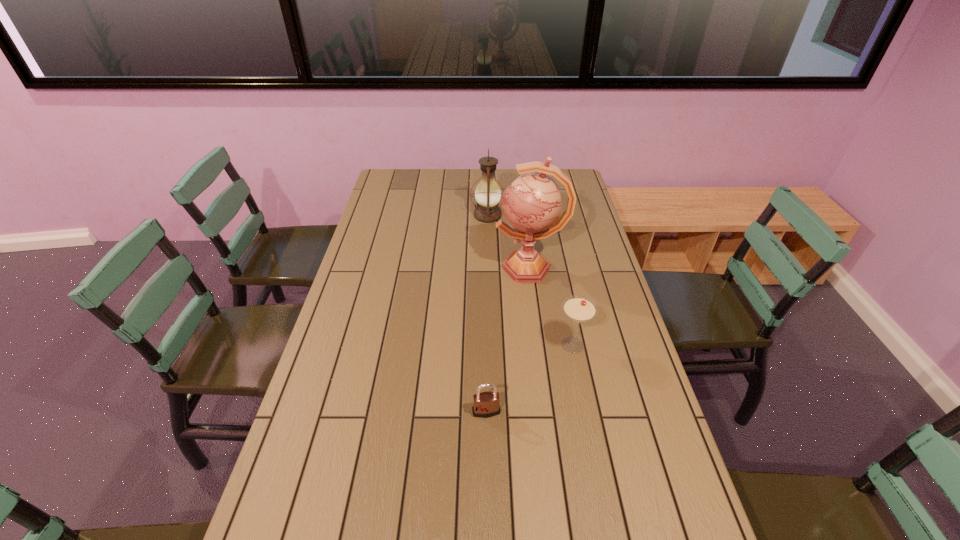
At what (x,y) coordinates should I click in order to perform the action: click on free area in between the padlock and the second tallest object. Please return your answer as a coordinate pair (x, y). Looking at the image, I should click on (487, 314).

Locate an element on the screen. This screenshot has width=960, height=540. vacant area between the shortest object and the farthest object is located at coordinates (487, 314).

Image resolution: width=960 pixels, height=540 pixels. I want to click on object that can be found as the second closest to the third tallest object, so click(486, 404).

Where is `the closest object relative to the tallest object`? This screenshot has width=960, height=540. the closest object relative to the tallest object is located at coordinates (487, 194).

Where is `vacant point that satisfies the following two spatial constraints: 1. on the front-facing side of the tallest object; 2. on the left side of the martini`? The height and width of the screenshot is (540, 960). vacant point that satisfies the following two spatial constraints: 1. on the front-facing side of the tallest object; 2. on the left side of the martini is located at coordinates (540, 345).